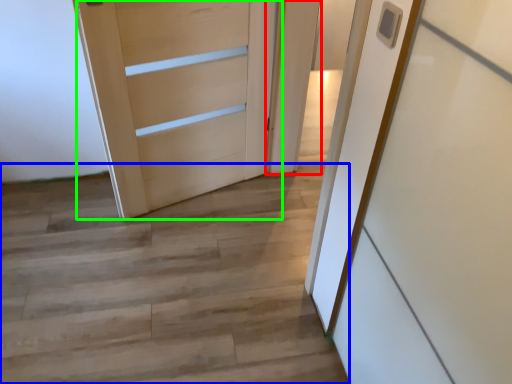
Question: Estimate the real-world distances between objects in this image. Which object is farther from door (highlighted by a red box), stairwell (highlighted by a blue box) or door (highlighted by a green box)?

Choices:
 (A) stairwell
 (B) door

Answer: (A)